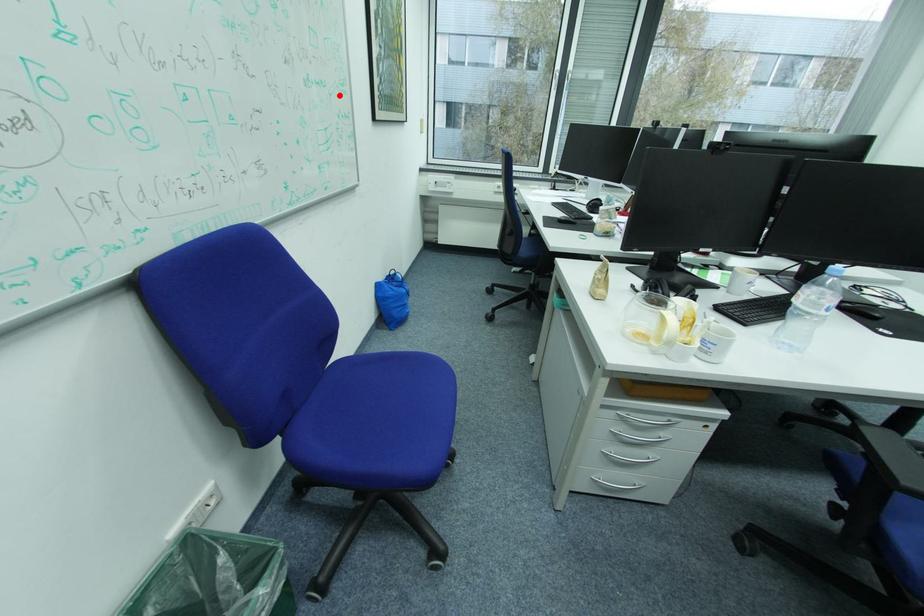
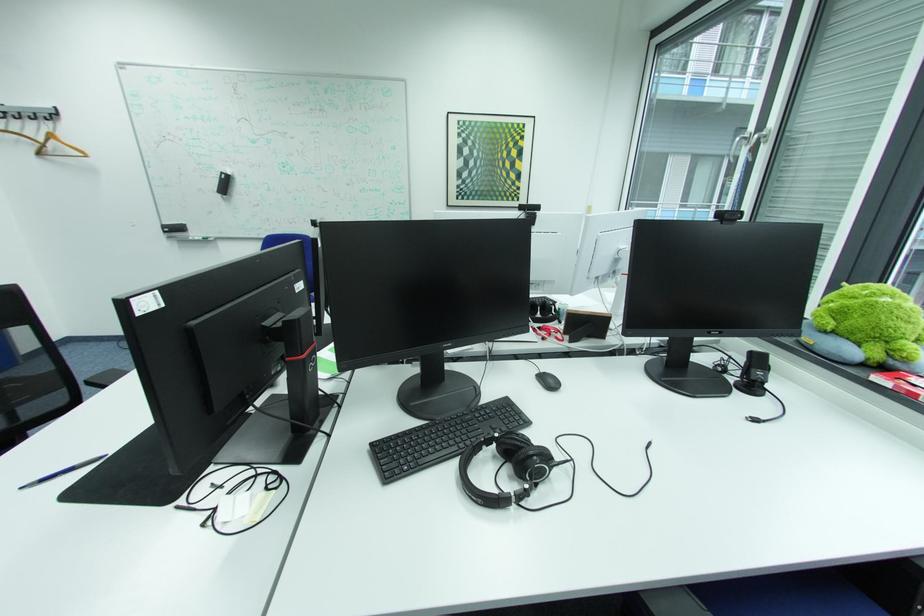
Find the pixel in the second image that matches the highlighted location in the first image.

(393, 195)